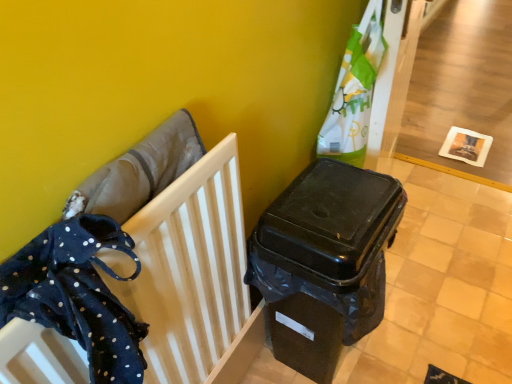
Question: Is dark blue fabric at left positioned with its back to black plastic waste container at center-right?

Choices:
 (A) yes
 (B) no

Answer: (B)

Question: Is dark blue fabric at left outside of black plastic waste container at center-right?

Choices:
 (A) no
 (B) yes

Answer: (B)

Question: Does dark blue fabric at left come in front of black plastic waste container at center-right?

Choices:
 (A) yes
 (B) no

Answer: (A)

Question: Does dark blue fabric at left have a lesser width compared to black plastic waste container at center-right?

Choices:
 (A) yes
 (B) no

Answer: (A)

Question: Is dark blue fabric at left facing towards black plastic waste container at center-right?

Choices:
 (A) no
 (B) yes

Answer: (A)

Question: Considering the positions of dark blue polka dot fabric at left and black plastic waste container at center-right in the image, is dark blue polka dot fabric at left bigger or smaller than black plastic waste container at center-right?

Choices:
 (A) big
 (B) small

Answer: (B)

Question: Looking at their shapes, would you say dark blue polka dot fabric at left is wider or thinner than black plastic waste container at center-right?

Choices:
 (A) thin
 (B) wide

Answer: (A)

Question: Considering the relative positions of dark blue polka dot fabric at left and black plastic waste container at center-right in the image provided, is dark blue polka dot fabric at left to the left or to the right of black plastic waste container at center-right?

Choices:
 (A) right
 (B) left

Answer: (B)

Question: Is dark blue polka dot fabric at left spatially inside black plastic waste container at center-right, or outside of it?

Choices:
 (A) outside
 (B) inside

Answer: (A)

Question: From the image's perspective, is dark blue fabric at left above or below dark blue polka dot fabric at left?

Choices:
 (A) below
 (B) above

Answer: (A)

Question: Looking at their shapes, would you say dark blue fabric at left is wider or thinner than dark blue polka dot fabric at left?

Choices:
 (A) wide
 (B) thin

Answer: (B)

Question: From a real-world perspective, is dark blue fabric at left physically located above or below dark blue polka dot fabric at left?

Choices:
 (A) below
 (B) above

Answer: (A)

Question: Do you think dark blue fabric at left is within dark blue polka dot fabric at left, or outside of it?

Choices:
 (A) inside
 (B) outside

Answer: (B)

Question: Would you say black plastic waste container at center-right is to the left or to the right of dark blue fabric at left in the picture?

Choices:
 (A) right
 (B) left

Answer: (A)

Question: Is black plastic waste container at center-right wider or thinner than dark blue fabric at left?

Choices:
 (A) thin
 (B) wide

Answer: (B)